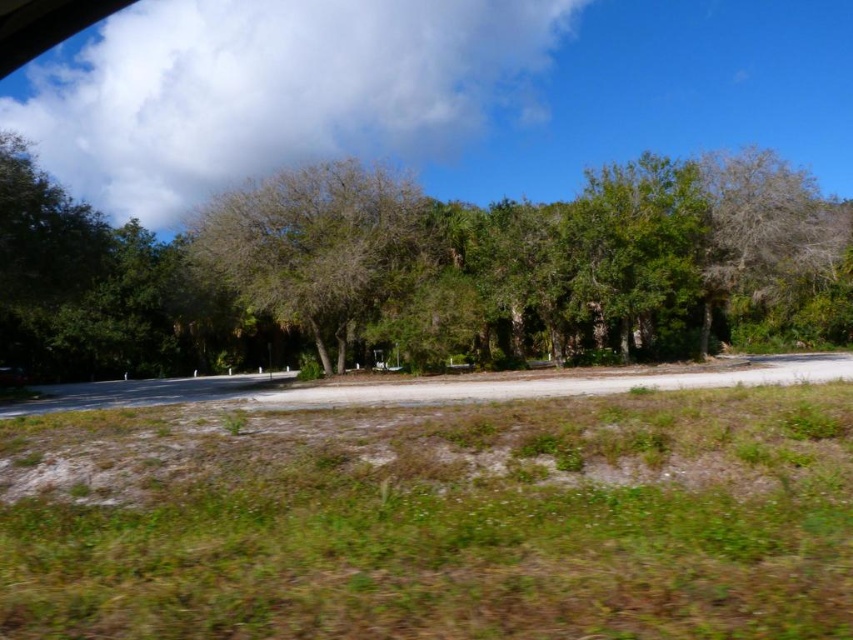
Question: Which of the following is the closest to the observer?

Choices:
 (A) (451, 225)
 (B) (604, 445)
 (C) (372, 256)

Answer: (B)

Question: Which of the following is the closest to the observer?

Choices:
 (A) green grass at lower center
 (B) brown textured tree at center

Answer: (A)

Question: Does green grass at lower center have a smaller size compared to green leafy tree at center?

Choices:
 (A) no
 (B) yes

Answer: (B)

Question: Can you confirm if green grass at lower center is positioned to the left of brown textured tree at center?

Choices:
 (A) yes
 (B) no

Answer: (B)

Question: Which object is farther from the camera taking this photo?

Choices:
 (A) green leafy tree at center
 (B) brown textured tree at center

Answer: (B)

Question: Does green grass at lower center have a greater width compared to brown textured tree at center?

Choices:
 (A) no
 (B) yes

Answer: (B)